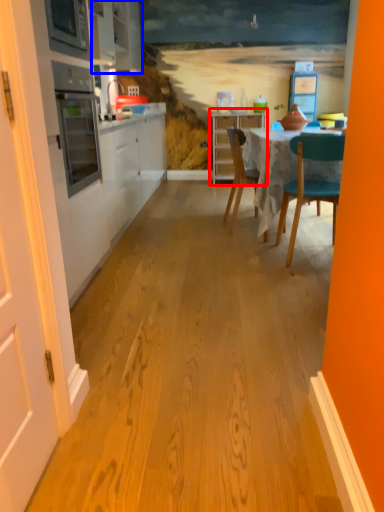
Question: Which point is closer to the camera, cabinetry (highlighted by a red box) or cabinetry (highlighted by a blue box)?

Choices:
 (A) cabinetry
 (B) cabinetry

Answer: (B)